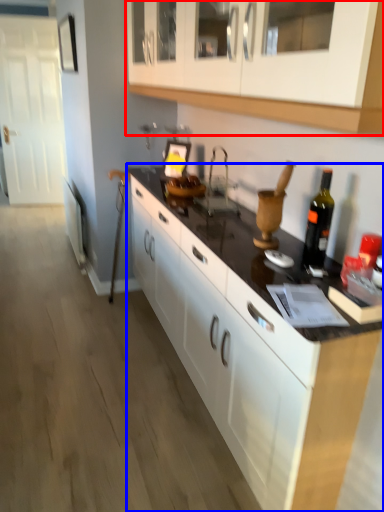
Question: Among these objects, which one is farthest to the camera, cabinetry (highlighted by a red box) or countertop (highlighted by a blue box)?

Choices:
 (A) cabinetry
 (B) countertop

Answer: (B)